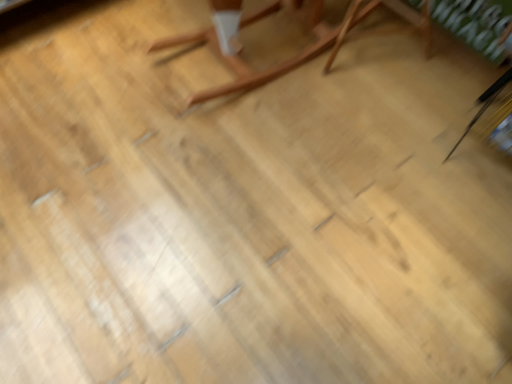
What do you see at coordinates (305, 48) in the screenshot? I see `light brown wood rocking chair at center` at bounding box center [305, 48].

What is the approximate width of light brown wood rocking chair at center?

It is 28.49 inches.

The width and height of the screenshot is (512, 384). Identify the location of light brown wood rocking chair at center. (305, 48).

This screenshot has height=384, width=512. Identify the location of light brown wood rocking chair at center. (305, 48).